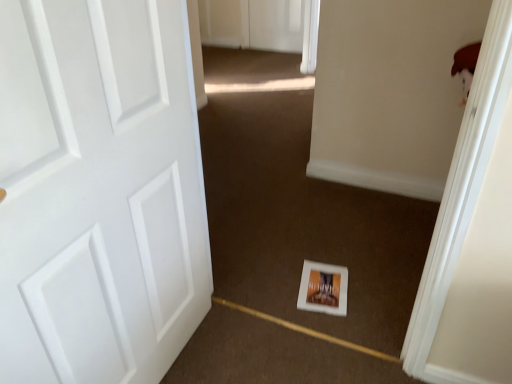
This screenshot has height=384, width=512. Find the location of `spots to the right of white matte postcard at center`. spots to the right of white matte postcard at center is located at coordinates (376, 288).